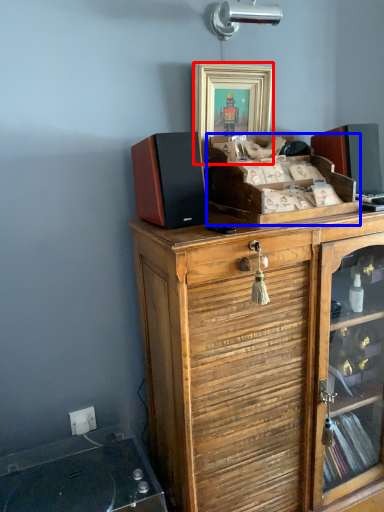
Question: Which object appears farthest to the camera in this image, picture frame (highlighted by a red box) or cabinetry (highlighted by a blue box)?

Choices:
 (A) picture frame
 (B) cabinetry

Answer: (A)